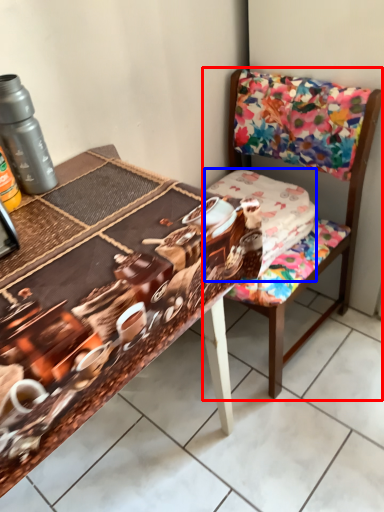
Question: Which point is further to the camera, chair (highlighted by a red box) or fabric (highlighted by a blue box)?

Choices:
 (A) chair
 (B) fabric

Answer: (B)